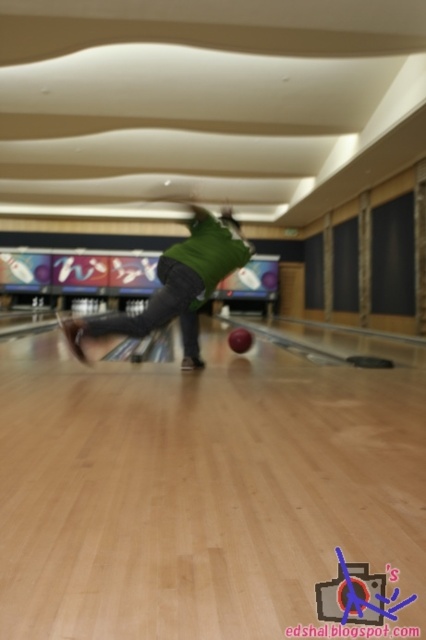
In the scene shown: Between green matte shirt at center and shiny red bowling ball at center, which one has more height?

green matte shirt at center

Does point (189, 250) come farther from viewer compared to point (233, 328)?

No, it is not.

Is point (69, 328) positioned before point (241, 349)?

Yes.

In order to click on green matte shirt at center in this screenshot , I will do point(176,285).